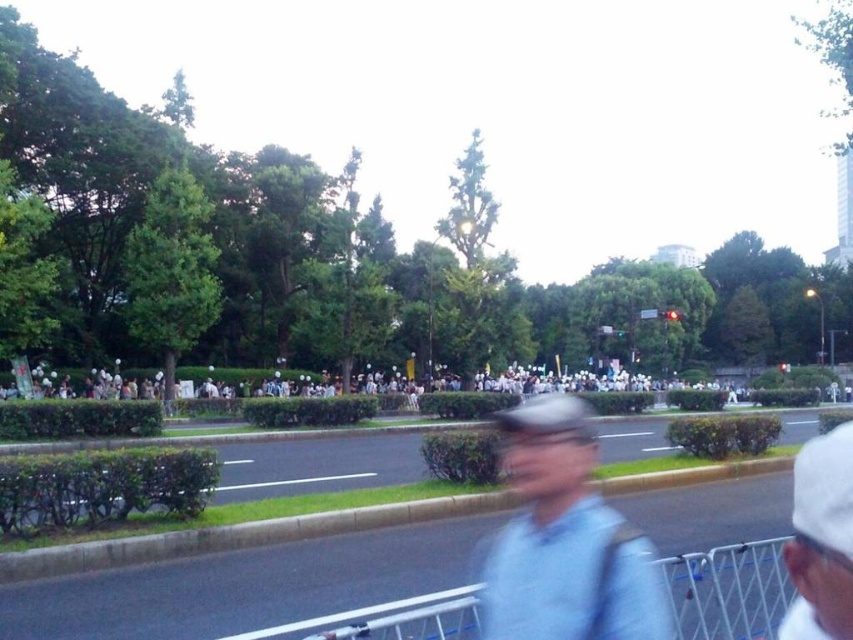
Which is in front, point (563, 476) or point (782, 634)?

Point (782, 634) is in front.

In the scene shown: Is light blue fabric at center taller than white matte cap at upper right?

Correct, light blue fabric at center is much taller as white matte cap at upper right.

This screenshot has width=853, height=640. Describe the element at coordinates (566, 540) in the screenshot. I see `light blue fabric at center` at that location.

I want to click on light blue fabric at center, so click(x=566, y=540).

Which is above, white metal rail at lower center or white matte cap at upper right?

white matte cap at upper right is above.

Can you confirm if white metal rail at lower center is bigger than white matte cap at upper right?

No.

Describe the element at coordinates (728, 589) in the screenshot. I see `white metal rail at lower center` at that location.

You are a GUI agent. You are given a task and a screenshot of the screen. Output one action in this format:
    pyautogui.click(x=<x>, y=<y>)
    Task: Click on the white metal rail at lower center
    Image resolution: width=853 pixels, height=640 pixels.
    Given the screenshot: What is the action you would take?
    pyautogui.click(x=728, y=589)

Which of these two, light blue fabric at center or white metal rail at lower center, stands shorter?

With less height is white metal rail at lower center.

Find the location of `light blue fabric at center`. light blue fabric at center is located at coordinates (566, 540).

Locate an element on the screen. This screenshot has width=853, height=640. light blue fabric at center is located at coordinates click(566, 540).